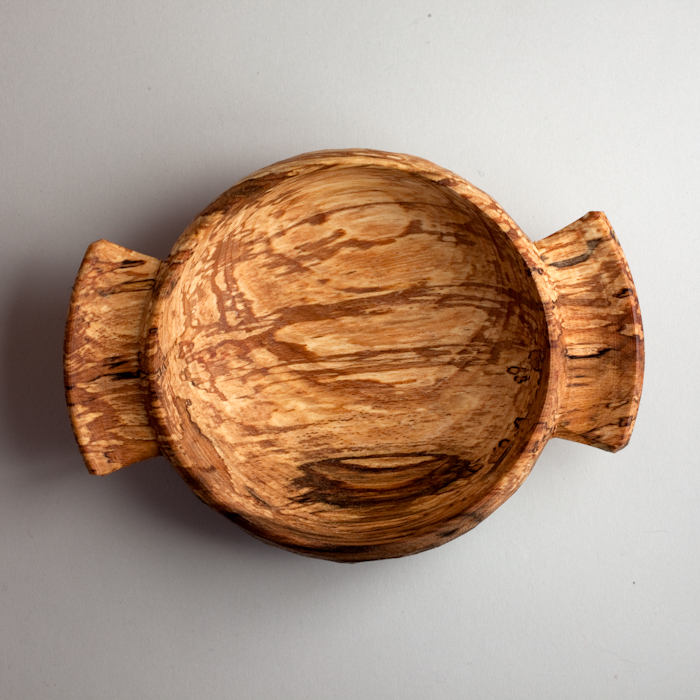
Locate an element on the screen. The width and height of the screenshot is (700, 700). handle is located at coordinates (615, 371).